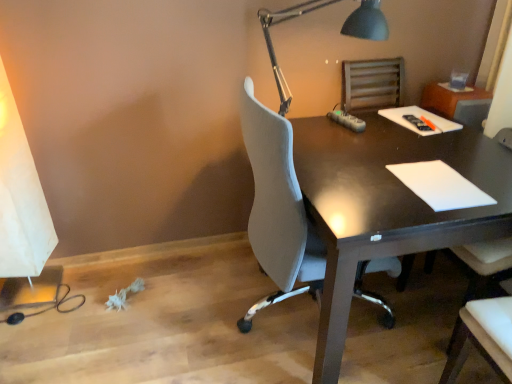
This screenshot has height=384, width=512. Identify the location of free location to the left of white matte notepad at right. (362, 182).